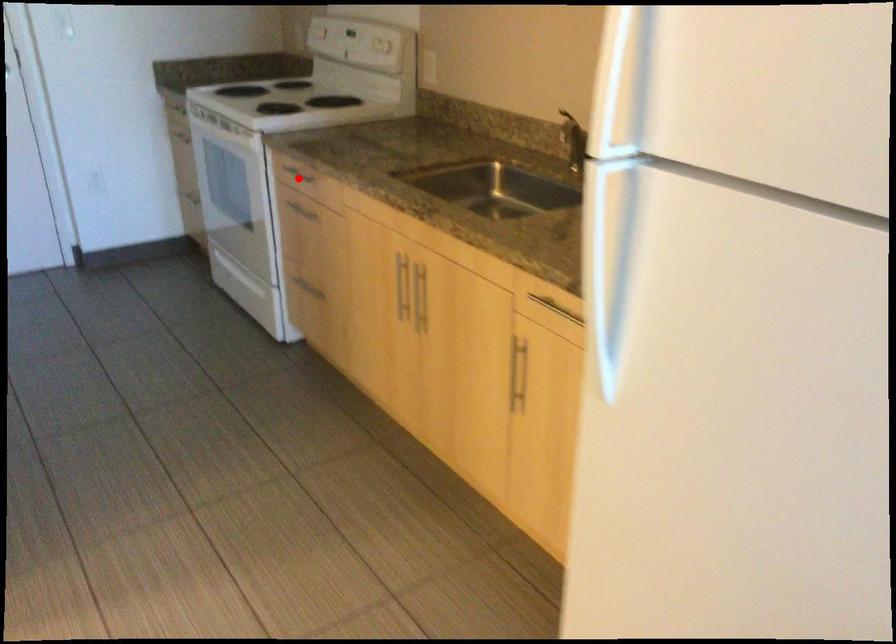
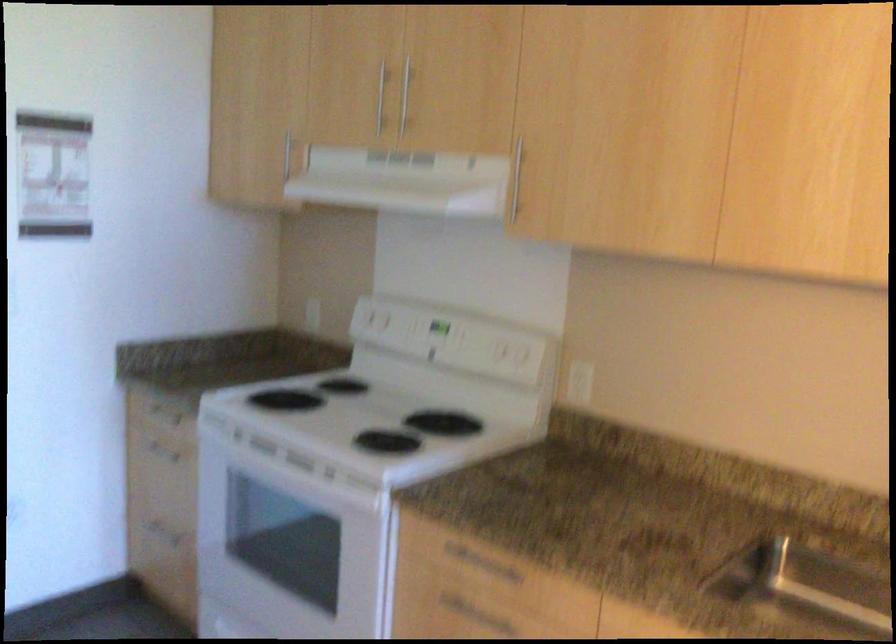
The point at the highlighted location is marked in the first image. Where is the corresponding point in the second image?

(480, 564)